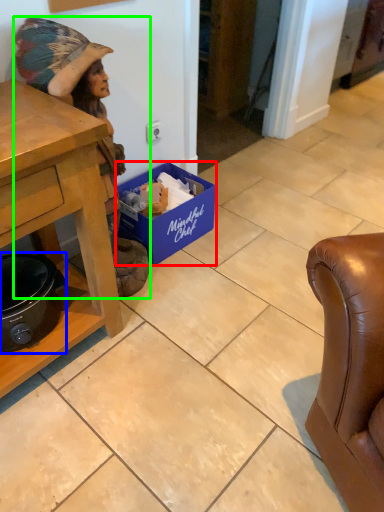
Question: Which object is positioned closest to box (highlighted by a red box)? Select from appliance (highlighted by a blue box) and person (highlighted by a green box).

Choices:
 (A) appliance
 (B) person

Answer: (B)